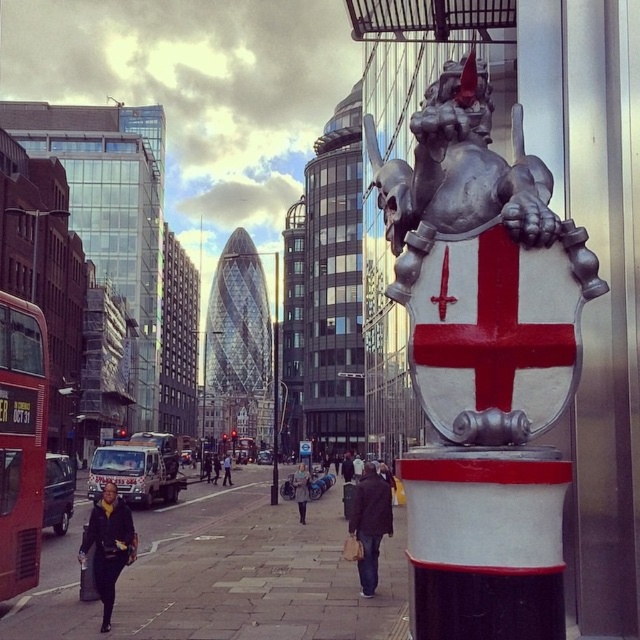
Question: Where is silver metallic shield at upper right located in relation to paved stone sidewalk at lower left in the image?

Choices:
 (A) left
 (B) right

Answer: (B)

Question: Which point appears closest to the camera in this image?

Choices:
 (A) (170, 540)
 (B) (20, 556)
 (C) (387, 164)

Answer: (C)

Question: Among these objects, which one is farthest from the camera?

Choices:
 (A) paved stone sidewalk at lower left
 (B) red double-decker bus at left
 (C) silver metallic shield at upper right

Answer: (B)

Question: Where is paved stone sidewalk at lower left located in relation to red double-decker bus at left in the image?

Choices:
 (A) right
 (B) left

Answer: (A)

Question: Which object is the closest to the red double-decker bus at left?

Choices:
 (A) silver metallic shield at upper right
 (B) paved stone sidewalk at lower left

Answer: (A)

Question: Does silver metallic shield at upper right appear on the left side of paved stone sidewalk at lower left?

Choices:
 (A) yes
 (B) no

Answer: (B)